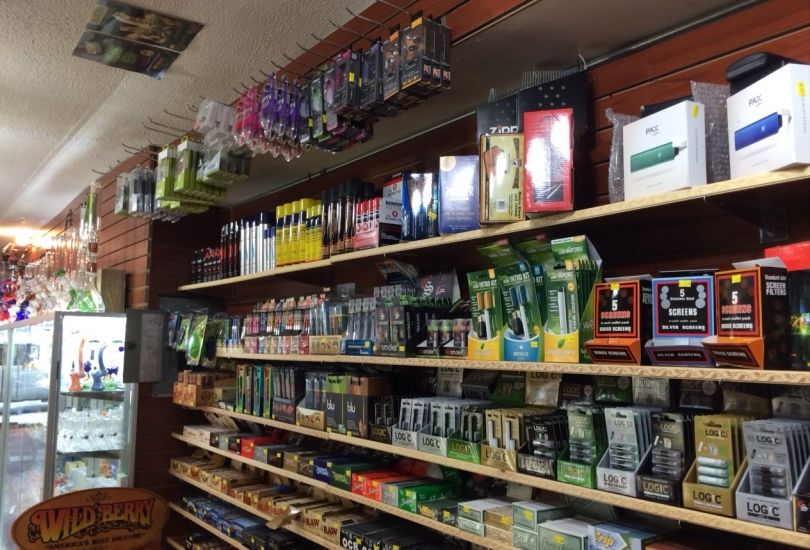
Locate an element on the screen. wall is located at coordinates (678, 59).